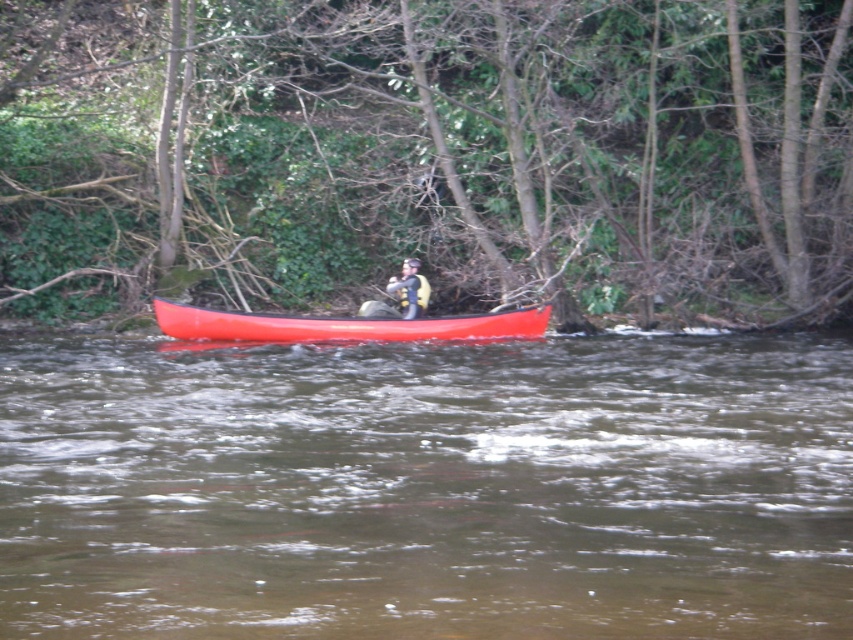
Question: Does green leafy tree at center have a larger size compared to brown murky water at center?

Choices:
 (A) no
 (B) yes

Answer: (B)

Question: Does brown murky water at center have a greater width compared to matte red canoe at center?

Choices:
 (A) yes
 (B) no

Answer: (A)

Question: Which point is closer to the camera?

Choices:
 (A) (386, 284)
 (B) (392, 337)
 (C) (675, 6)

Answer: (B)

Question: Is the position of brown murky water at center less distant than that of matte yellow life vest at center?

Choices:
 (A) yes
 (B) no

Answer: (A)

Question: Which point is farther to the camera?

Choices:
 (A) matte yellow life vest at center
 (B) green leafy tree at center

Answer: (B)

Question: Among these objects, which one is nearest to the camera?

Choices:
 (A) green leafy tree at center
 (B) brown murky water at center
 (C) matte yellow life vest at center

Answer: (B)